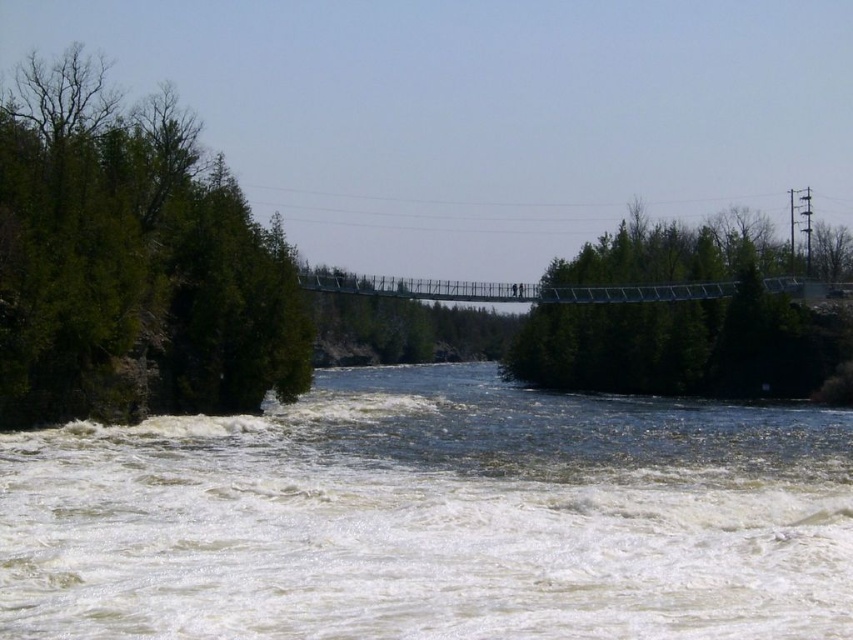
Question: Which point is closer to the camera taking this photo?

Choices:
 (A) (486, 435)
 (B) (180, 385)

Answer: (A)

Question: Does white frothy water at lower center have a larger size compared to green leafy tree at left?

Choices:
 (A) no
 (B) yes

Answer: (A)

Question: Can you confirm if green leafy tree at left is positioned above green leafy trees at center?

Choices:
 (A) yes
 (B) no

Answer: (B)

Question: Which point is closer to the camera?

Choices:
 (A) green leafy trees at center
 (B) green leafy tree at left

Answer: (B)

Question: Considering the relative positions of white frothy water at lower center and green leafy trees at center in the image provided, where is white frothy water at lower center located with respect to green leafy trees at center?

Choices:
 (A) left
 (B) right

Answer: (A)

Question: Among these points, which one is farthest from the camera?

Choices:
 (A) (361, 408)
 (B) (49, 164)

Answer: (A)